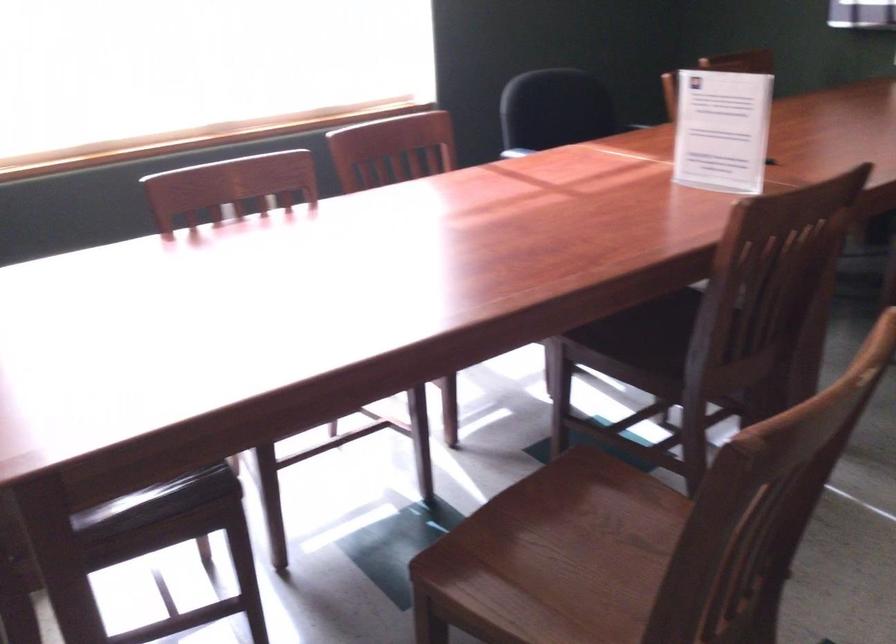
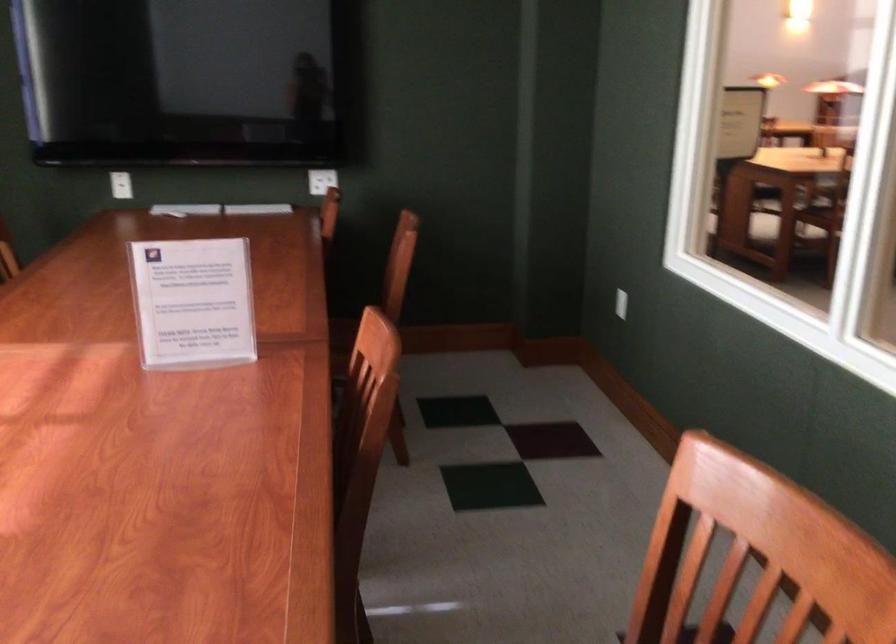
In the second image, find the point that corresponds to point (709, 127) in the first image.

(193, 303)